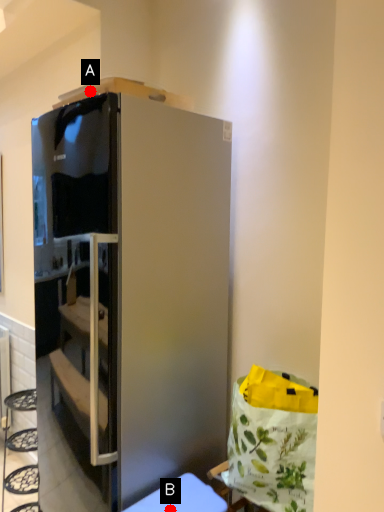
Question: Two points are circled on the image, labeled by A and B beside each circle. Which point is closer to the camera?

Choices:
 (A) A is closer
 (B) B is closer

Answer: (B)